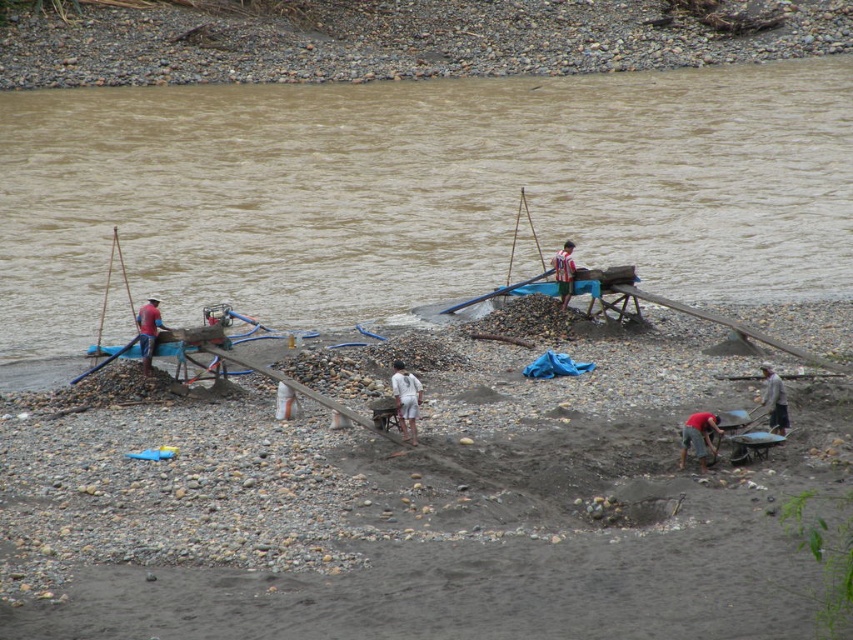
You are a safety inspector at the construction site. You see the brown muddy water at center and the red fabric shirt at lower right. Which object is located above the other?

The brown muddy water at center is positioned over red fabric shirt at lower right, so the brown muddy water at center is above the red fabric shirt at lower right.

You are a construction worker standing at the riverbank. You need to reach a specific point marked at coordinates point (775,401). Your supervisor says you can only move forward 60 feet. Can you reach the point?

The distance of point (775,401) from viewer is 71.63 feet, so you cannot reach it since moving forward 60 feet is insufficient to cover the 71.63 feet distance.